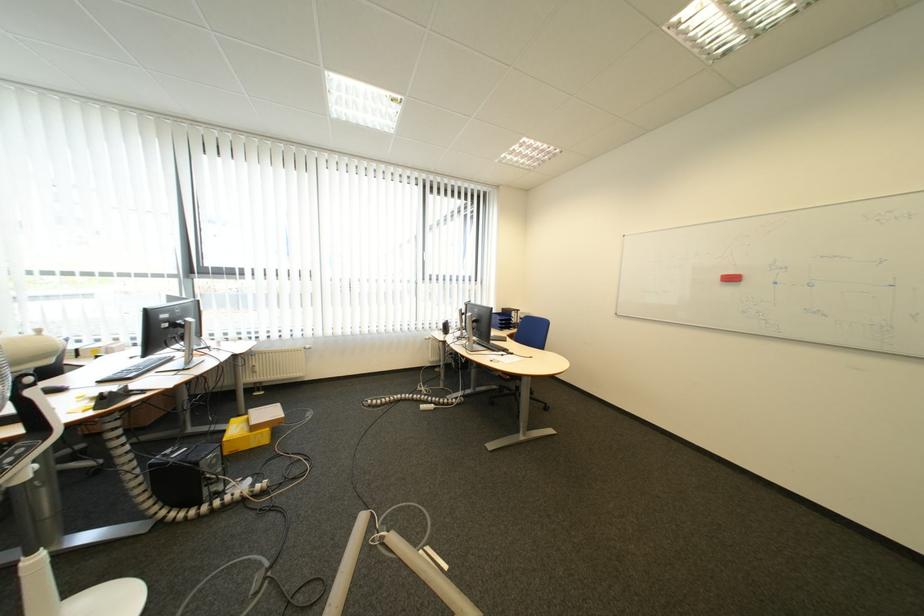
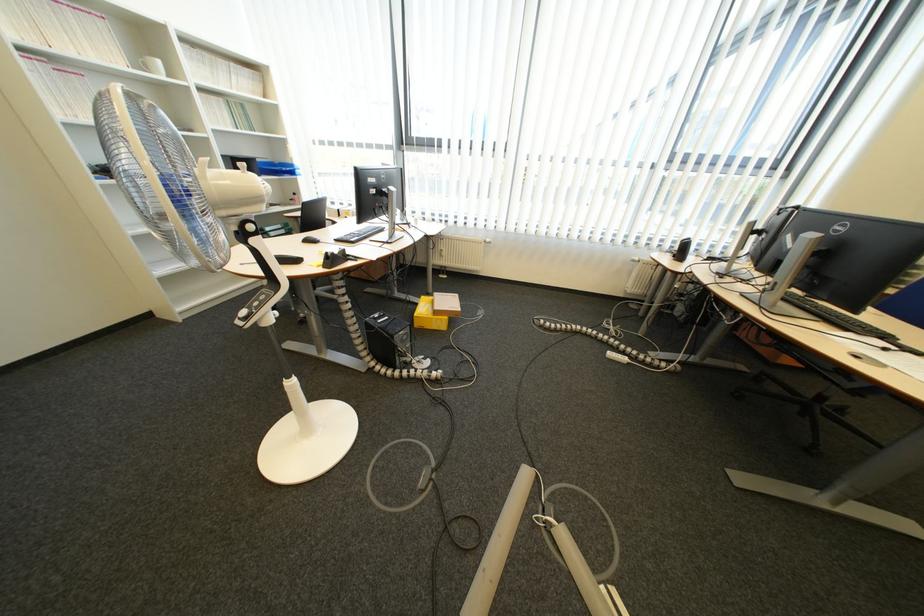
How did the camera likely rotate?

The camera rotated toward left-down.